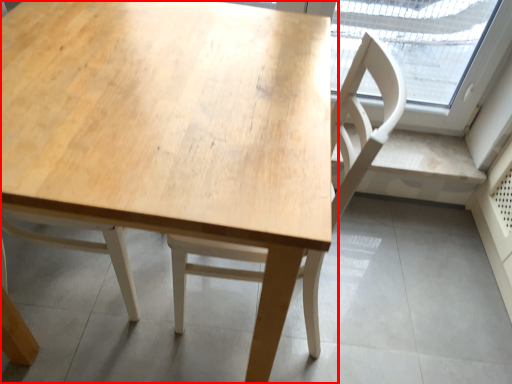
Question: From the image's perspective, what is the correct spatial relationship of table (annotated by the red box) in relation to chair?

Choices:
 (A) below
 (B) above

Answer: (B)